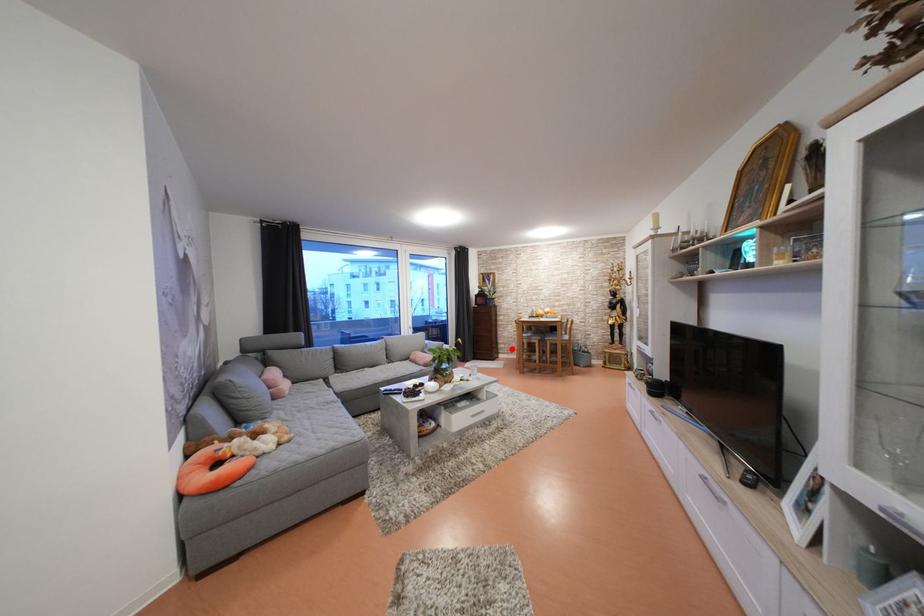
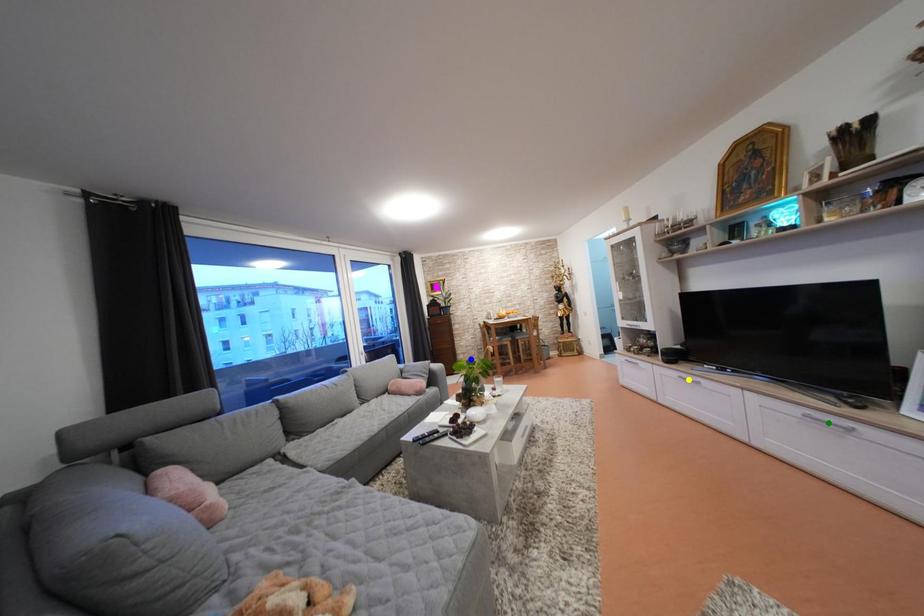
Question: I am providing you with two images of the same scene from different viewpoints. A red point is marked on the first image. You are given multiple points on the second image. Which mark in image 2 goes with the point in image 1?

Choices:
 (A) blue point
 (B) yellow point
 (C) green point

Answer: (A)